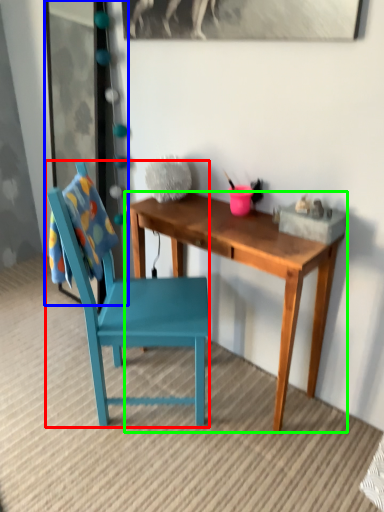
Question: Based on their relative distances, which object is farther from chair (highlighted by a red box)? Choose from glass door (highlighted by a blue box) and desk (highlighted by a green box).

Choices:
 (A) glass door
 (B) desk

Answer: (A)